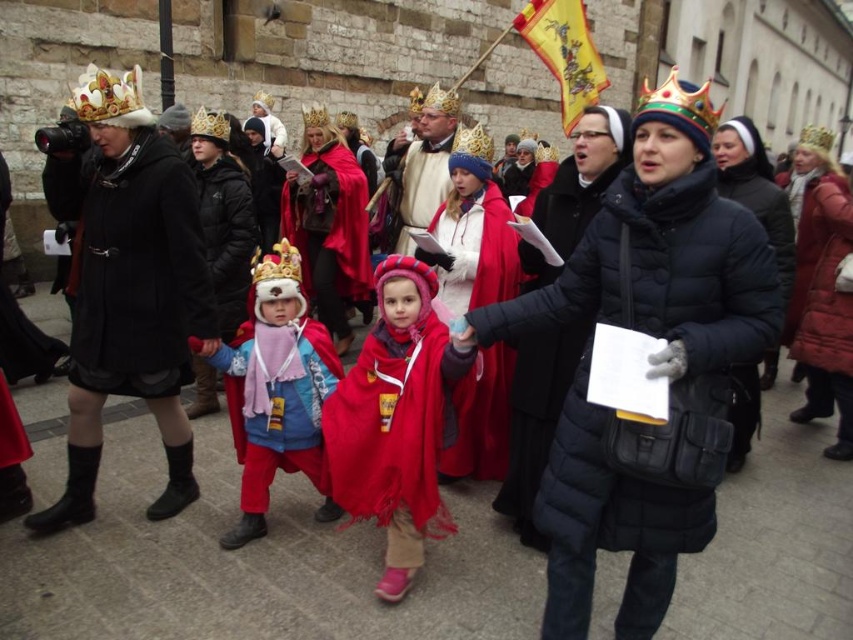
Is velvet red cape at center smaller than black quilted jacket at center?

Yes.

Where is `velvet red cape at center`? velvet red cape at center is located at coordinates (276, 390).

Who is more distant from viewer, (x=329, y=508) or (x=567, y=332)?

The point (x=567, y=332) is behind.

This screenshot has width=853, height=640. What are the coordinates of `velvet red cape at center` in the screenshot? It's located at (276, 390).

Is black puffy coat at center shorter than fuzzy red scarf at center?

Incorrect, black puffy coat at center's height does not fall short of fuzzy red scarf at center's.

Identify the location of black puffy coat at center. (662, 276).

Is velvet red cape at center below smooth gold crown at center?

Indeed, velvet red cape at center is positioned under smooth gold crown at center.

Between velvet red cape at center and smooth gold crown at center, which one has less height?

With less height is velvet red cape at center.

Identify the location of velvet red cape at center. (276, 390).